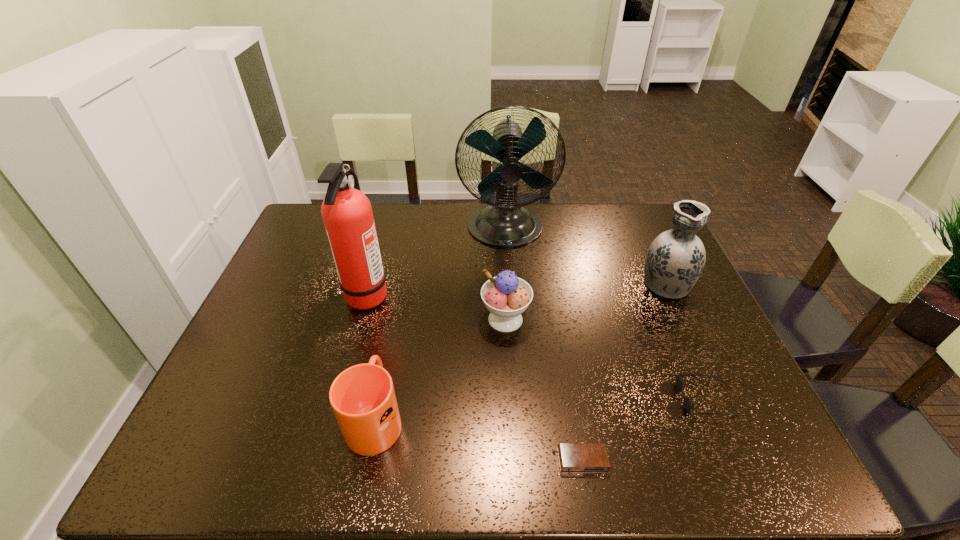
Identify the location of object that is the closest to the farthest object. This screenshot has height=540, width=960. (347, 214).

Where is `free space that satisfies the following two spatial constraints: 1. on the front-facing side of the farthest object; 2. on the handle side of the fire extinguisher`? free space that satisfies the following two spatial constraints: 1. on the front-facing side of the farthest object; 2. on the handle side of the fire extinguisher is located at coordinates (510, 294).

Where is `free space that satisfies the following two spatial constraints: 1. on the handle side of the mug; 2. on the handle side of the fire extinguisher`? free space that satisfies the following two spatial constraints: 1. on the handle side of the mug; 2. on the handle side of the fire extinguisher is located at coordinates (399, 294).

You are a GUI agent. You are given a task and a screenshot of the screen. Output one action in this format:
    pyautogui.click(x=<x>, y=<y>)
    Task: Click on the free space that satisfies the following two spatial constraints: 1. on the front-facing side of the farthest object; 2. on the handle side of the fire extinguisher
    The image size is (960, 540).
    Given the screenshot: What is the action you would take?
    pyautogui.click(x=510, y=294)

This screenshot has width=960, height=540. I want to click on blank area in the image that satisfies the following two spatial constraints: 1. on the front-facing side of the farthest object; 2. on the handle side of the fire extinguisher, so (x=510, y=294).